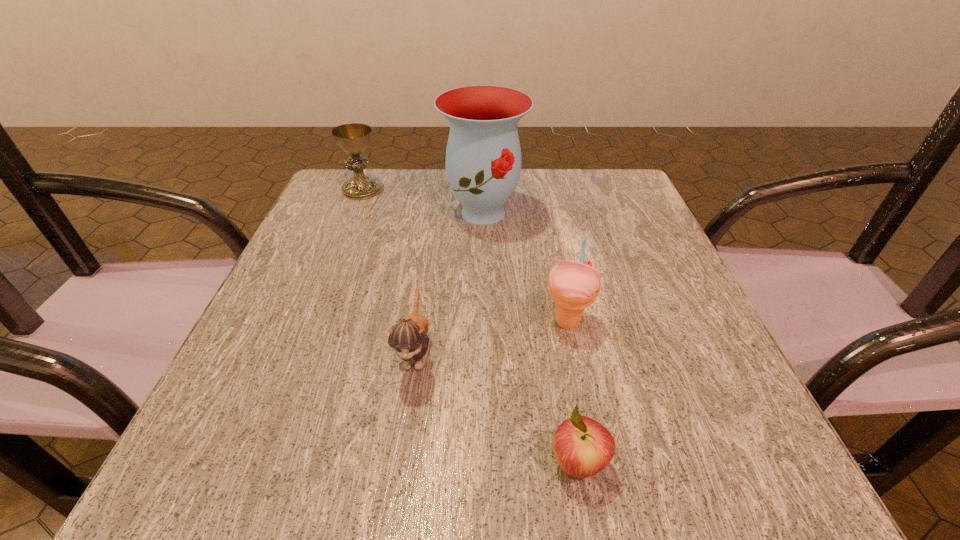
Locate an element on the screen. Image resolution: width=960 pixels, height=540 pixels. the tallest object is located at coordinates (483, 156).

Where is `the leftmost object`? The height and width of the screenshot is (540, 960). the leftmost object is located at coordinates (353, 138).

The width and height of the screenshot is (960, 540). I want to click on icecream, so click(x=573, y=285).

Locate an element on the screen. kitten is located at coordinates (408, 338).

Identify the location of apple. (582, 446).

Locate an element on the screen. The height and width of the screenshot is (540, 960). free space located on the right of the vase is located at coordinates (605, 212).

The width and height of the screenshot is (960, 540). I want to click on free point located on the right of the leftmost object, so click(452, 190).

I want to click on free space located 0.350m on the left of the icecream, so click(333, 322).

The height and width of the screenshot is (540, 960). I want to click on free point located 0.110m on the front-facing side of the kitten, so click(399, 467).

Locate an element on the screen. The height and width of the screenshot is (540, 960). vacant space positioned on the left of the apple is located at coordinates (286, 464).